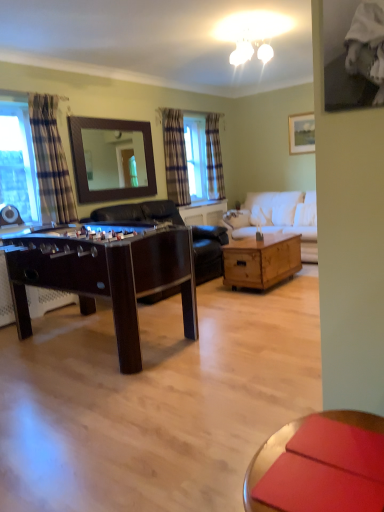
Question: Is wooden framed mirror at upper center taller than plaid fabric curtain at center, which is the 1th curtain in back-to-front order?

Choices:
 (A) yes
 (B) no

Answer: (B)

Question: Does wooden framed mirror at upper center have a lesser height compared to plaid fabric curtain at center, which is the 1th curtain in back-to-front order?

Choices:
 (A) yes
 (B) no

Answer: (A)

Question: Can you confirm if wooden framed mirror at upper center is wider than plaid fabric curtain at center, which is the 3th curtain in left-to-right order?

Choices:
 (A) yes
 (B) no

Answer: (B)

Question: Is wooden framed mirror at upper center oriented away from plaid fabric curtain at center, which is the 3th curtain in left-to-right order?

Choices:
 (A) no
 (B) yes

Answer: (A)

Question: Is wooden framed mirror at upper center positioned before plaid fabric curtain at center, which is the 1th curtain in back-to-front order?

Choices:
 (A) yes
 (B) no

Answer: (A)

Question: Relative to dark wood foosball table at center, positioned as the 2th table in back-to-front order, is matte wooden picture frame at upper right in front or behind?

Choices:
 (A) behind
 (B) front

Answer: (A)

Question: Based on their positions, is matte wooden picture frame at upper right located to the left or right of dark wood foosball table at center, positioned as the second table in right-to-left order?

Choices:
 (A) left
 (B) right

Answer: (B)

Question: Considering the positions of matte wooden picture frame at upper right and dark wood foosball table at center, the first table when ordered from front to back, in the image, is matte wooden picture frame at upper right wider or thinner than dark wood foosball table at center, the first table when ordered from front to back,?

Choices:
 (A) wide
 (B) thin

Answer: (B)

Question: Considering the positions of matte wooden picture frame at upper right and dark wood foosball table at center, the first table when ordered from front to back, in the image, is matte wooden picture frame at upper right taller or shorter than dark wood foosball table at center, the first table when ordered from front to back,?

Choices:
 (A) short
 (B) tall

Answer: (A)

Question: Considering their positions, is dark wood foosball table at center, the first table when ordered from front to back, located in front of or behind plaid fabric curtain at center, the 1th curtain in the right-to-left sequence?

Choices:
 (A) front
 (B) behind

Answer: (A)

Question: Choose the correct answer: Is dark wood foosball table at center, positioned as the second table in right-to-left order, inside plaid fabric curtain at center, which is the third curtain from front to back, or outside it?

Choices:
 (A) inside
 (B) outside

Answer: (B)

Question: Is dark wood foosball table at center, positioned as the 2th table in back-to-front order, taller or shorter than plaid fabric curtain at center, which is the 3th curtain in left-to-right order?

Choices:
 (A) tall
 (B) short

Answer: (B)

Question: Is dark wood foosball table at center, which appears as the first table when viewed from the left, wider or thinner than plaid fabric curtain at center, the 1th curtain in the right-to-left sequence?

Choices:
 (A) wide
 (B) thin

Answer: (A)

Question: In the image, is white fabric couch at center on the left side or the right side of plaid fabric curtain at left, the 1th curtain when ordered from left to right?

Choices:
 (A) left
 (B) right

Answer: (B)

Question: Is white fabric couch at center wider or thinner than plaid fabric curtain at left, the 1th curtain when ordered from left to right?

Choices:
 (A) thin
 (B) wide

Answer: (B)